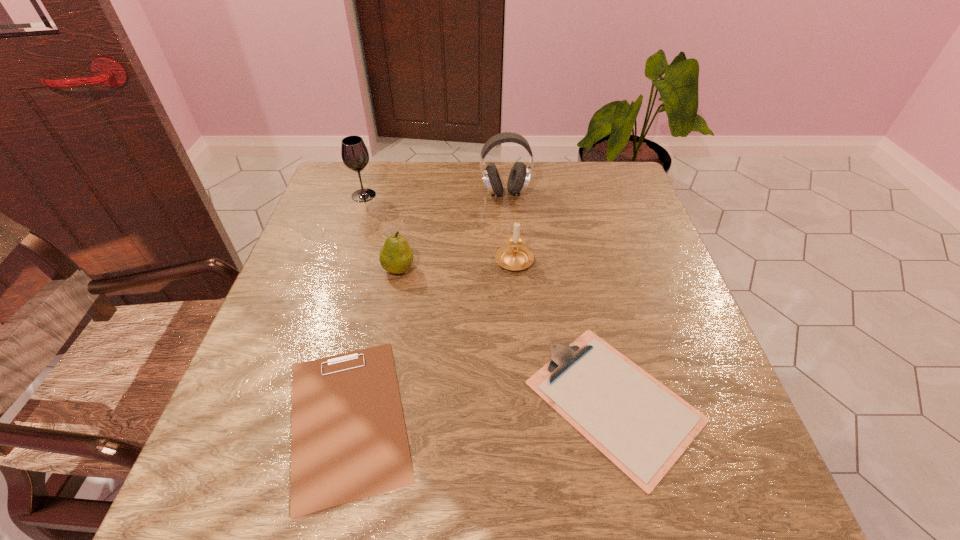
Find the location of a particular element. headset is located at coordinates (519, 176).

This screenshot has height=540, width=960. I want to click on wineglass, so click(x=355, y=156).

Locate an element on the screen. candle holder is located at coordinates (514, 256).

What are the coordinates of `pear` in the screenshot? It's located at (396, 256).

The image size is (960, 540). What are the coordinates of `the right clipboard` in the screenshot? It's located at (641, 426).

You are a GUI agent. You are given a task and a screenshot of the screen. Output one action in this format:
    pyautogui.click(x=<x>, y=<y>)
    Task: Click on the taller clipboard
    Image resolution: width=960 pixels, height=540 pixels.
    Given the screenshot: What is the action you would take?
    pyautogui.click(x=641, y=426)

Find the location of `the shortest object`. the shortest object is located at coordinates (348, 442).

At what (x,y) coordinates should I click in order to perform the action: click on the left clipboard. Please return your answer as a coordinate pair (x, y). The width and height of the screenshot is (960, 540). Looking at the image, I should click on [348, 442].

Where is `vacant space located 0.240m on the ear cups of the headset`? vacant space located 0.240m on the ear cups of the headset is located at coordinates (510, 259).

Identify the location of free space located 0.080m on the front of the wineglass. (356, 220).